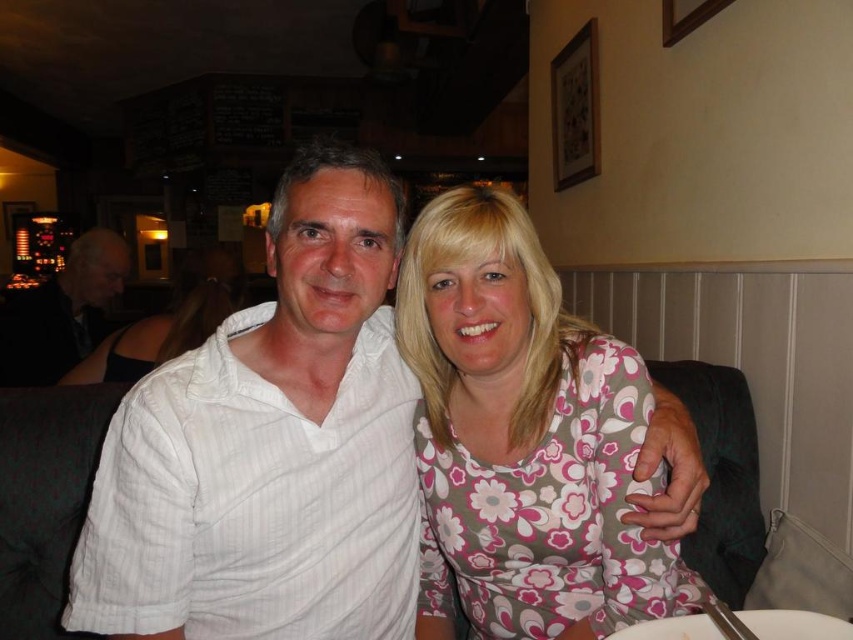
Based on the photo, does white striped shirt at center have a lesser width compared to white shirt at left?

Indeed, white striped shirt at center has a lesser width compared to white shirt at left.

Locate an element on the screen. The width and height of the screenshot is (853, 640). white striped shirt at center is located at coordinates (270, 445).

Which is above, white striped shirt at center or floral fabric blouse at center?

floral fabric blouse at center is higher up.

Locate an element on the screen. white striped shirt at center is located at coordinates (270, 445).

Locate an element on the screen. The height and width of the screenshot is (640, 853). white striped shirt at center is located at coordinates (270, 445).

Does floral-patterned shirt at center appear on the right side of white shirt at left?

Yes, floral-patterned shirt at center is to the right of white shirt at left.

Is floral-patterned shirt at center behind white shirt at left?

That is False.

Does point (553, 528) come farther from viewer compared to point (15, 378)?

No, (553, 528) is closer to viewer.

Where is `floral-patterned shirt at center`? floral-patterned shirt at center is located at coordinates (523, 435).